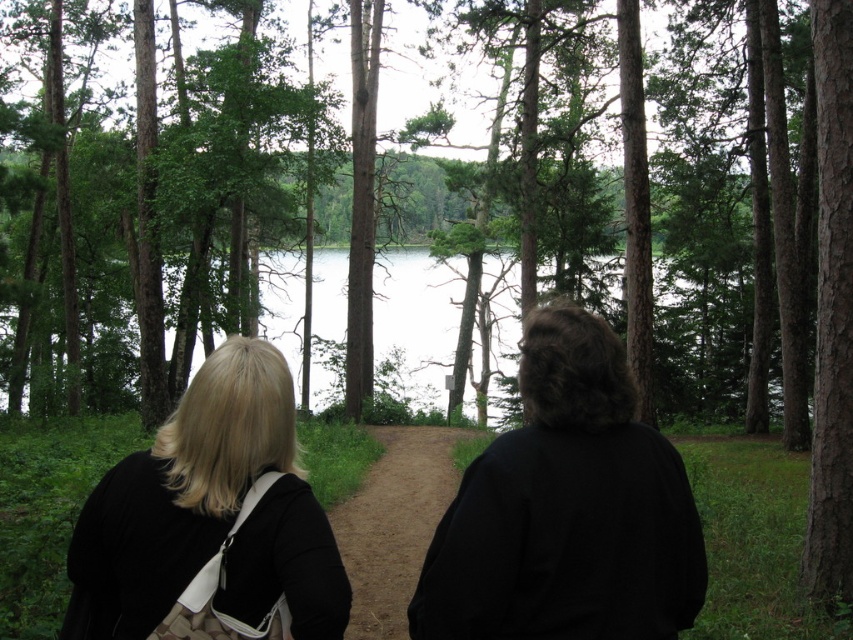
Question: Does brown textured tree at center appear under blonde hair at center?

Choices:
 (A) yes
 (B) no

Answer: (B)

Question: Which of the following is the closest to the observer?

Choices:
 (A) black matte jacket at center
 (B) blonde hair at center
 (C) clear water at center

Answer: (B)

Question: Which object is closer to the camera taking this photo?

Choices:
 (A) brown textured tree at center
 (B) dirt path at center
 (C) blonde hair at center

Answer: (C)

Question: From the image, what is the correct spatial relationship of blonde hair at center in relation to clear water at center?

Choices:
 (A) left
 (B) right

Answer: (B)

Question: Which of the following is the closest to the observer?

Choices:
 (A) dirt path at center
 (B) brown textured tree at center
 (C) black matte jacket at center
 (D) blonde hair at center

Answer: (D)

Question: Can you confirm if clear water at center is positioned below dirt path at center?

Choices:
 (A) no
 (B) yes

Answer: (A)